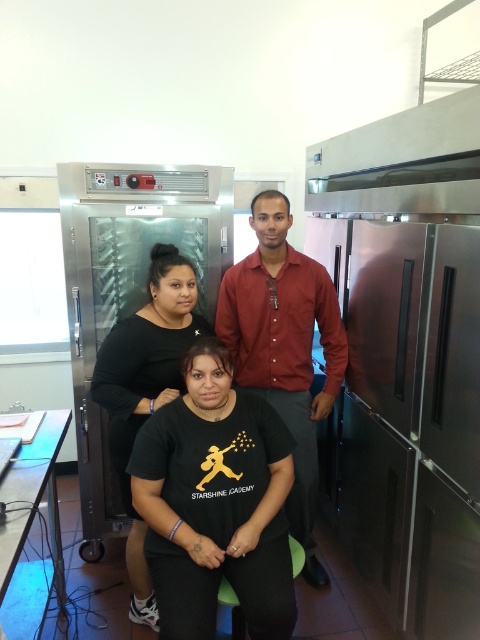
Question: Is black matte t-shirt at center below black matte dress at center?

Choices:
 (A) yes
 (B) no

Answer: (A)

Question: Does black matte t-shirt at center appear over black matte shirt at center?

Choices:
 (A) no
 (B) yes

Answer: (A)

Question: Which object is the farthest from the matte red shirt at center?

Choices:
 (A) black matte t-shirt at center
 (B) black matte shirt at center
 (C) black matte dress at center

Answer: (A)

Question: Is matte red shirt at center bigger than black matte dress at center?

Choices:
 (A) yes
 (B) no

Answer: (A)

Question: Which object is farther from the camera taking this photo?

Choices:
 (A) black matte dress at center
 (B) black matte t-shirt at center
 (C) matte red shirt at center
 (D) black matte shirt at center

Answer: (C)

Question: Among these points, which one is nearest to the camera?

Choices:
 (A) (311, 474)
 (B) (194, 390)
 (C) (288, 257)
 (D) (159, 301)

Answer: (B)